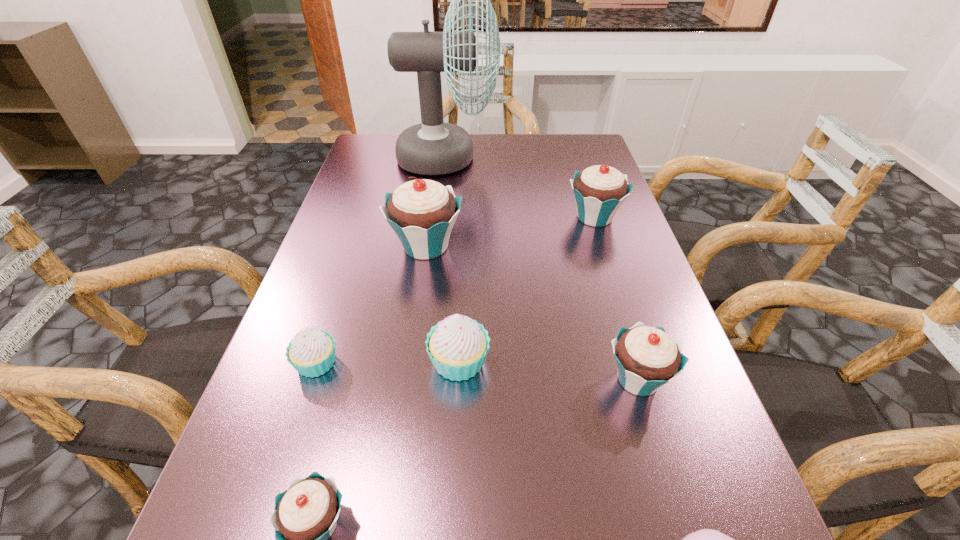
The height and width of the screenshot is (540, 960). I want to click on cupcake that is the closest to the left white cupcake, so click(457, 346).

At what (x,y) coordinates should I click in order to perform the action: click on cupcake that stands as the third closest to the right white cupcake. Please return your answer as a coordinate pair (x, y). Looking at the image, I should click on (305, 515).

Identify which teal cupcake is the third closest to the biggest teal cupcake. Please provide its 2D coordinates. Your answer should be formatted as a tuple, i.e. [(x, y)], where the tuple contains the x and y coordinates of a point satisfying the conditions above.

[(305, 515)]

Locate an element on the screen. The width and height of the screenshot is (960, 540). teal cupcake that is the closest to the tallest object is located at coordinates click(422, 212).